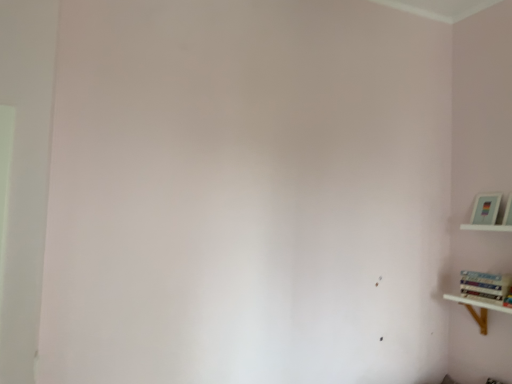
Question: Is white wooden shelf at upper right, the 2th shelf when ordered from bottom to top, thinner than hardcover book at right?

Choices:
 (A) yes
 (B) no

Answer: (A)

Question: From a real-world perspective, is white wooden shelf at upper right, the first shelf from the top, below hardcover book at right?

Choices:
 (A) yes
 (B) no

Answer: (B)

Question: Does white wooden shelf at upper right, the first shelf from the top, come behind hardcover book at right?

Choices:
 (A) yes
 (B) no

Answer: (A)

Question: Is white wooden shelf at upper right, the 2th shelf when ordered from bottom to top, wider than hardcover book at right?

Choices:
 (A) yes
 (B) no

Answer: (B)

Question: From the image's perspective, would you say white wooden shelf at upper right, the 2th shelf when ordered from bottom to top, is shown under hardcover book at right?

Choices:
 (A) yes
 (B) no

Answer: (B)

Question: Relative to white wooden shelf at lower right, which is the 2th shelf from top to bottom, is white wooden shelf at upper right, the 2th shelf when ordered from bottom to top, in front or behind?

Choices:
 (A) behind
 (B) front

Answer: (A)

Question: Looking at their shapes, would you say white wooden shelf at upper right, the 2th shelf when ordered from bottom to top, is wider or thinner than white wooden shelf at lower right, which is the 2th shelf from top to bottom?

Choices:
 (A) thin
 (B) wide

Answer: (A)

Question: Does point (472, 213) appear closer or farther from the camera than point (468, 297)?

Choices:
 (A) farther
 (B) closer

Answer: (A)

Question: From their relative heights in the image, would you say white wooden shelf at upper right, the 2th shelf when ordered from bottom to top, is taller or shorter than white wooden shelf at lower right, which is the 2th shelf from top to bottom?

Choices:
 (A) tall
 (B) short

Answer: (B)

Question: Based on their sizes in the image, would you say white wooden shelf at lower right, which is the 2th shelf from top to bottom, is bigger or smaller than white wooden shelf at upper right, the first shelf from the top?

Choices:
 (A) big
 (B) small

Answer: (A)

Question: Is white wooden shelf at lower right, the 1th shelf in the bottom-to-top sequence, situated inside white wooden shelf at upper right, the first shelf from the top, or outside?

Choices:
 (A) outside
 (B) inside

Answer: (A)

Question: In the image, is white wooden shelf at lower right, which is the 2th shelf from top to bottom, positioned in front of or behind white wooden shelf at upper right, the first shelf from the top?

Choices:
 (A) behind
 (B) front

Answer: (B)

Question: In terms of width, does white wooden shelf at lower right, the 1th shelf in the bottom-to-top sequence, look wider or thinner when compared to white wooden shelf at upper right, the 2th shelf when ordered from bottom to top?

Choices:
 (A) wide
 (B) thin

Answer: (A)

Question: Visually, is white wooden shelf at lower right, the 1th shelf in the bottom-to-top sequence, positioned to the left or to the right of hardcover book at right?

Choices:
 (A) right
 (B) left

Answer: (B)

Question: Based on their sizes in the image, would you say white wooden shelf at lower right, which is the 2th shelf from top to bottom, is bigger or smaller than hardcover book at right?

Choices:
 (A) small
 (B) big

Answer: (B)